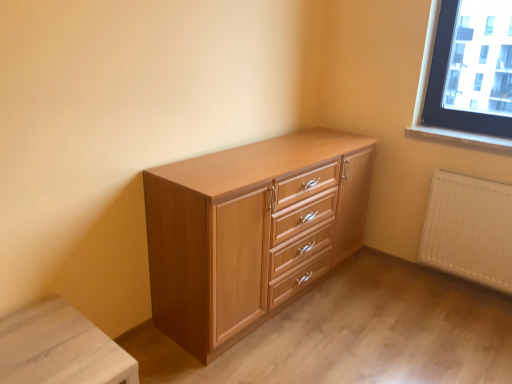
Identify the location of light wood changing table at lower left. (60, 348).

Describe the element at coordinates (469, 229) in the screenshot. I see `white matte radiator at lower right` at that location.

This screenshot has width=512, height=384. I want to click on light brown wood chest of drawers at center, so click(x=251, y=231).

Based on the photo, from the image's perspective, is light wood changing table at lower left located above or below smooth wood window sill at upper right?

light wood changing table at lower left is below smooth wood window sill at upper right.

Are light wood changing table at lower left and smooth wood window sill at upper right beside each other?

light wood changing table at lower left is not next to smooth wood window sill at upper right, and they're not touching.

This screenshot has width=512, height=384. What are the coordinates of `window sill lying above the light wood changing table at lower left (from the image's perspective)` in the screenshot? It's located at (460, 137).

Between smooth wood window sill at upper right and light brown wood chest of drawers at center, which one is positioned behind?

smooth wood window sill at upper right.

Can you confirm if smooth wood window sill at upper right is wider than light brown wood chest of drawers at center?

No, smooth wood window sill at upper right is not wider than light brown wood chest of drawers at center.

Does smooth wood window sill at upper right have a larger size compared to light brown wood chest of drawers at center?

Actually, smooth wood window sill at upper right might be smaller than light brown wood chest of drawers at center.

Where is `the chest of drawers in front of the smooth wood window sill at upper right`? the chest of drawers in front of the smooth wood window sill at upper right is located at coordinates (251, 231).

Is light brown wood chest of drawers at center facing towards smooth wood window sill at upper right?

Yes, light brown wood chest of drawers at center is oriented towards smooth wood window sill at upper right.

I want to click on window sill lying above the light brown wood chest of drawers at center (from the image's perspective), so click(x=460, y=137).

Which object is positioned more to the left, light brown wood chest of drawers at center or smooth wood window sill at upper right?

light brown wood chest of drawers at center.

From the image's perspective, which object appears higher, light brown wood chest of drawers at center or smooth wood window sill at upper right?

From the image's view, smooth wood window sill at upper right is above.

Based on their sizes in the image, would you say white matte radiator at lower right is bigger or smaller than light brown wood chest of drawers at center?

Clearly, white matte radiator at lower right is smaller in size than light brown wood chest of drawers at center.

Looking at this image, which of these two, white matte radiator at lower right or light brown wood chest of drawers at center, stands shorter?

white matte radiator at lower right.

From a real-world perspective, relative to light brown wood chest of drawers at center, is white matte radiator at lower right vertically above or below?

From a real-world perspective, white matte radiator at lower right is physically below light brown wood chest of drawers at center.

In the image, is white matte radiator at lower right positioned in front of or behind light brown wood chest of drawers at center?

white matte radiator at lower right is positioned farther from the viewer than light brown wood chest of drawers at center.

How far apart are light brown wood chest of drawers at center and light wood changing table at lower left?

31.83 inches.

Is there a large distance between light brown wood chest of drawers at center and light wood changing table at lower left?

No, light brown wood chest of drawers at center is not far from light wood changing table at lower left.

In the image, is light brown wood chest of drawers at center positioned in front of or behind light wood changing table at lower left?

light brown wood chest of drawers at center is positioned farther from the viewer than light wood changing table at lower left.

In terms of height, does smooth wood window sill at upper right look taller or shorter compared to light wood changing table at lower left?

Clearly, smooth wood window sill at upper right is shorter compared to light wood changing table at lower left.

Is smooth wood window sill at upper right positioned before light wood changing table at lower left?

No, it is behind light wood changing table at lower left.

From a real-world perspective, between smooth wood window sill at upper right and light wood changing table at lower left, who is vertically higher?

smooth wood window sill at upper right is physically above.

From the image's perspective, which one is positioned lower, light brown wood chest of drawers at center or white matte radiator at lower right?

white matte radiator at lower right.

Considering the positions of objects light brown wood chest of drawers at center and white matte radiator at lower right in the image provided, who is more to the right, light brown wood chest of drawers at center or white matte radiator at lower right?

From the viewer's perspective, white matte radiator at lower right appears more on the right side.

Is the position of light brown wood chest of drawers at center less distant than that of white matte radiator at lower right?

That is True.

Is light brown wood chest of drawers at center aimed at white matte radiator at lower right?

Yes, light brown wood chest of drawers at center is aimed at white matte radiator at lower right.

The image size is (512, 384). Find the location of `changing table to the left of smooth wood window sill at upper right`. changing table to the left of smooth wood window sill at upper right is located at coordinates point(60,348).

Locate an element on the screen. The width and height of the screenshot is (512, 384). the chest of drawers that appears below the smooth wood window sill at upper right (from the image's perspective) is located at coordinates (251, 231).

Considering their positions, is white matte radiator at lower right positioned closer to smooth wood window sill at upper right than light wood changing table at lower left?

white matte radiator at lower right lies closer to smooth wood window sill at upper right than the other object.

Considering their positions, is smooth wood window sill at upper right positioned closer to light wood changing table at lower left than light brown wood chest of drawers at center?

Among the two, light brown wood chest of drawers at center is located nearer to light wood changing table at lower left.

Considering their positions, is light brown wood chest of drawers at center positioned further to light wood changing table at lower left than smooth wood window sill at upper right?

smooth wood window sill at upper right lies further to light wood changing table at lower left than the other object.

Considering their positions, is smooth wood window sill at upper right positioned closer to light brown wood chest of drawers at center than white matte radiator at lower right?

Among the two, white matte radiator at lower right is located nearer to light brown wood chest of drawers at center.

From the image, which object appears to be farther from light wood changing table at lower left, smooth wood window sill at upper right or white matte radiator at lower right?

smooth wood window sill at upper right.

Based on their spatial positions, is smooth wood window sill at upper right or light wood changing table at lower left closer to light brown wood chest of drawers at center?

light wood changing table at lower left is positioned closer to the anchor light brown wood chest of drawers at center.

Considering their positions, is white matte radiator at lower right positioned closer to light wood changing table at lower left than light brown wood chest of drawers at center?

The object closer to light wood changing table at lower left is light brown wood chest of drawers at center.

When comparing their distances from smooth wood window sill at upper right, does light wood changing table at lower left or white matte radiator at lower right seem closer?

Among the two, white matte radiator at lower right is located nearer to smooth wood window sill at upper right.

Identify the location of chest of drawers between light wood changing table at lower left and smooth wood window sill at upper right. (251, 231).

Image resolution: width=512 pixels, height=384 pixels. I want to click on chest of drawers between light wood changing table at lower left and white matte radiator at lower right from left to right, so click(x=251, y=231).

Locate an element on the screen. window sill located between light brown wood chest of drawers at center and white matte radiator at lower right in the left-right direction is located at coordinates (460, 137).

The image size is (512, 384). I want to click on window sill situated between light wood changing table at lower left and white matte radiator at lower right from left to right, so click(460, 137).